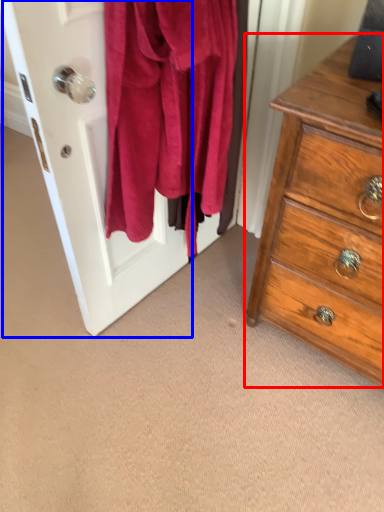
Question: Which of the following is the closest to the observer, chest of drawers (highlighted by a red box) or screen door (highlighted by a blue box)?

Choices:
 (A) chest of drawers
 (B) screen door

Answer: (B)